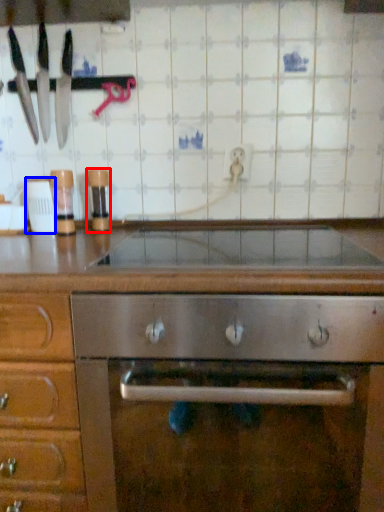
Question: Among these objects, which one is farthest to the camera, appliance (highlighted by a red box) or appliance (highlighted by a blue box)?

Choices:
 (A) appliance
 (B) appliance

Answer: (A)